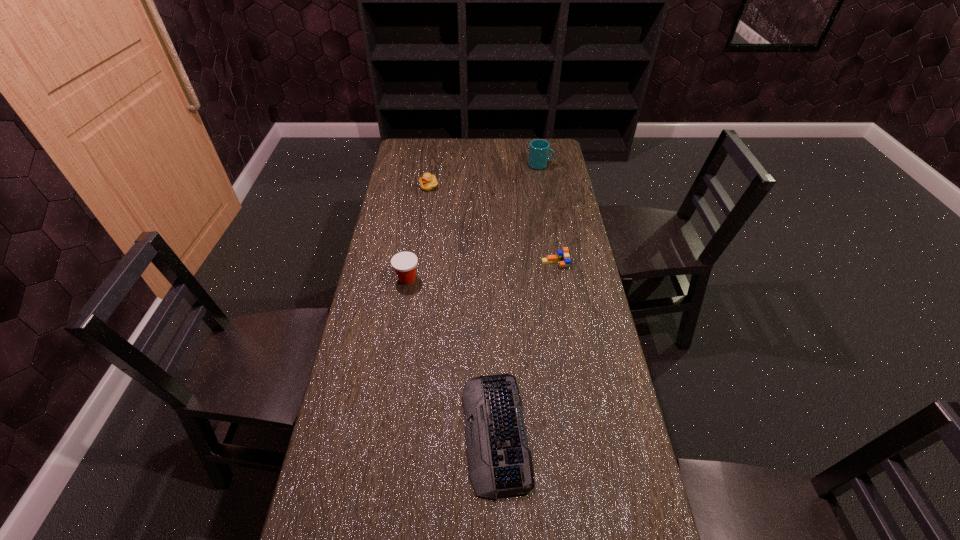
In the image, there is a desktop. At what (x,y) coordinates should I click in order to perform the action: click on vacant space at the far edge. Please return your answer as a coordinate pair (x, y). This screenshot has height=540, width=960. Looking at the image, I should click on (493, 146).

Locate an element on the screen. The height and width of the screenshot is (540, 960). free point at the left edge is located at coordinates click(x=398, y=336).

At what (x,y) coordinates should I click in order to perform the action: click on free location at the right edge of the desktop. Please return your answer as a coordinate pair (x, y). Looking at the image, I should click on (588, 418).

Image resolution: width=960 pixels, height=540 pixels. In the image, there is a desktop. Identify the location of vacant space at the far left corner. (420, 154).

The image size is (960, 540). In order to click on vacant area at the far right corner in this screenshot , I will do `click(537, 139)`.

Identify the location of empty space that is in between the farthest object and the shortest object. The image size is (960, 540). (518, 299).

The image size is (960, 540). I want to click on free spot between the fourth nearest object and the tallest object, so click(485, 176).

Where is `vacant region between the computer keyboard and the fourth shortest object`? The width and height of the screenshot is (960, 540). vacant region between the computer keyboard and the fourth shortest object is located at coordinates (451, 356).

Find the location of a particular element. This screenshot has width=960, height=540. vacant point located between the Dixie cup and the tallest object is located at coordinates (474, 222).

Image resolution: width=960 pixels, height=540 pixels. What are the coordinates of `unoccupied position between the second shortest object and the cup` in the screenshot? It's located at (548, 214).